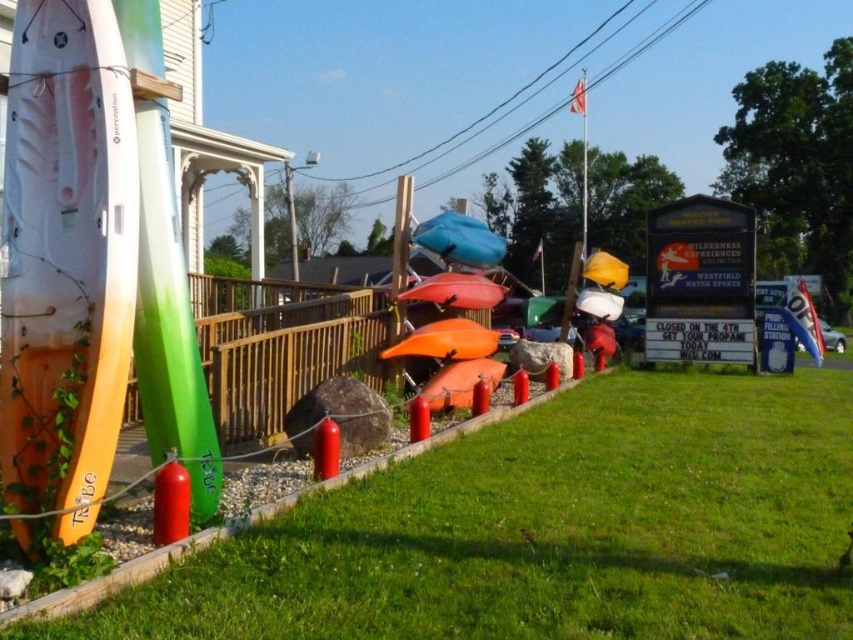
Identify the location of white matte surfboard at left. (67, 259).

Is point (68, 534) closer to viewer compared to point (140, 38)?

Yes, it is.

Who is more distant from viewer, (41, 180) or (165, 300)?

The point (165, 300) is behind.

Locate an element on the screen. The image size is (853, 640). white matte surfboard at left is located at coordinates (67, 259).

Based on the photo, does translucent green surfboard at left have a greater width compared to orange matte kayak at center?

No.

Who is shorter, translucent green surfboard at left or orange matte kayak at center?

With less height is orange matte kayak at center.

Between point (190, 433) and point (494, 372), which one is positioned in front?

Point (190, 433) is in front.

Find the location of a particular element. This screenshot has height=640, width=853. translucent green surfboard at left is located at coordinates (169, 323).

Is point (514, 612) positioned after point (62, 380)?

That is False.

From the picture: Between green grass at lower center and white matte surfboard at left, which one is positioned higher?

white matte surfboard at left

Identify the location of green grass at lower center. This screenshot has height=640, width=853. (550, 531).

Find the location of a particular element. This screenshot has height=640, width=853. green grass at lower center is located at coordinates (550, 531).